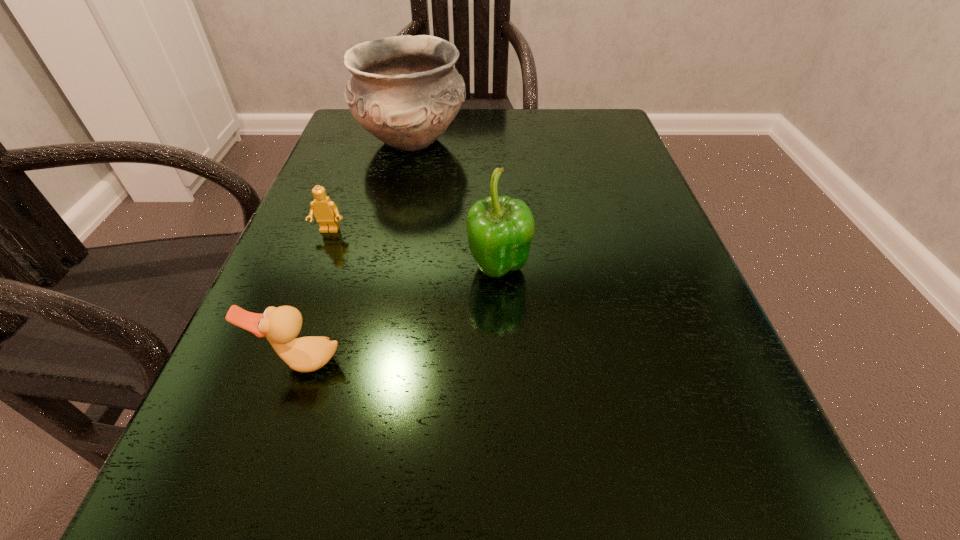
The height and width of the screenshot is (540, 960). I want to click on object that is at the far edge, so click(404, 90).

This screenshot has height=540, width=960. What are the coordinates of `pottery located at the left edge` in the screenshot? It's located at (404, 90).

Where is `duck situated at the left edge`? The image size is (960, 540). duck situated at the left edge is located at coordinates (281, 325).

Locate an element on the screen. This screenshot has width=960, height=540. Lego that is at the left edge is located at coordinates (325, 211).

At what (x,y) coordinates should I click in order to perform the action: click on object that is at the far left corner. Please return your answer as a coordinate pair (x, y). Looking at the image, I should click on (404, 90).

Locate an element on the screen. This screenshot has height=540, width=960. vacant space at the far edge of the desktop is located at coordinates (483, 118).

The height and width of the screenshot is (540, 960). In the image, there is a desktop. Find the location of `vacant region at the near edge`. vacant region at the near edge is located at coordinates (364, 510).

The image size is (960, 540). What are the coordinates of `vacant space at the left edge of the desktop` in the screenshot? It's located at (211, 452).

This screenshot has width=960, height=540. In the image, there is a desktop. In order to click on vacant space at the right edge in this screenshot , I will do `click(736, 395)`.

In the image, there is a desktop. What are the coordinates of `vacant space at the far left corner` in the screenshot? It's located at (349, 112).